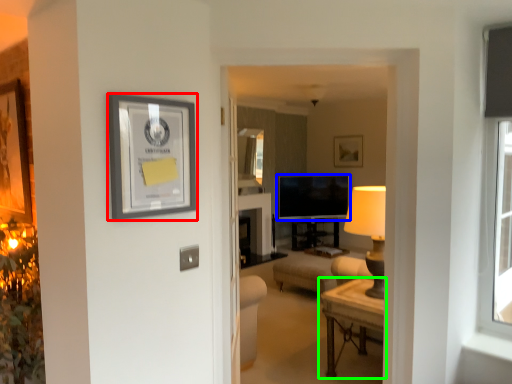
Question: Estimate the real-world distances between objects in this image. Which object is closer to picture frame (highlighted by a red box), television (highlighted by a blue box) or table (highlighted by a green box)?

Choices:
 (A) television
 (B) table

Answer: (B)